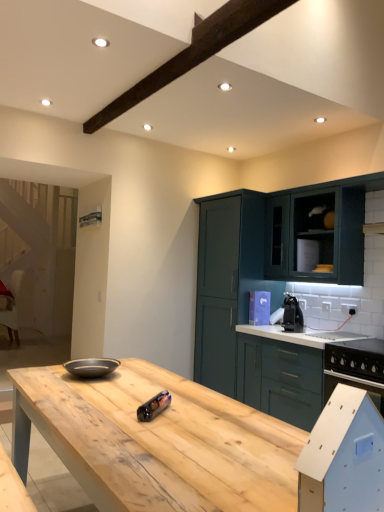
You are a GUI agent. You are given a task and a screenshot of the screen. Output one action in this format:
    pyautogui.click(x=<x>, y=<y>)
    Task: Click on the empty space that is ontop of natural wood table at center (from a real-world perspective)
    The image size is (384, 512).
    Given the screenshot: What is the action you would take?
    pyautogui.click(x=159, y=409)